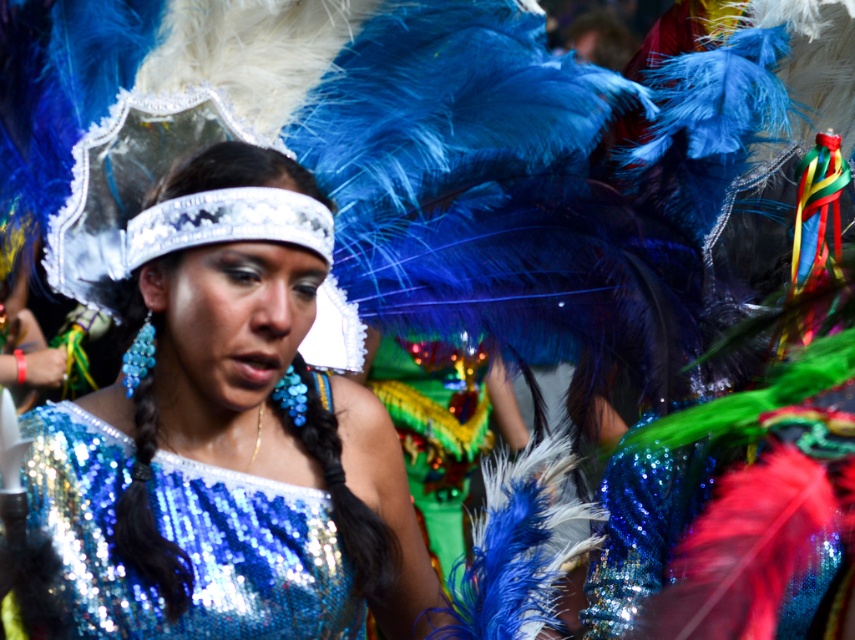
Question: Does shiny sequined dress at center have a greater width compared to shiny sequined top at center?

Choices:
 (A) no
 (B) yes

Answer: (B)

Question: Among these objects, which one is nearest to the camera?

Choices:
 (A) shiny sequined top at center
 (B) shiny sequined dress at center

Answer: (B)

Question: Which point is closer to the camera?

Choices:
 (A) (186, 600)
 (B) (240, 552)

Answer: (A)

Question: Can you confirm if shiny sequined dress at center is positioned to the left of shiny sequined top at center?

Choices:
 (A) no
 (B) yes

Answer: (A)

Question: Is shiny sequined dress at center thinner than shiny sequined top at center?

Choices:
 (A) no
 (B) yes

Answer: (A)

Question: Among these points, which one is farthest from the camera?

Choices:
 (A) [174, 444]
 (B) [304, 528]

Answer: (A)